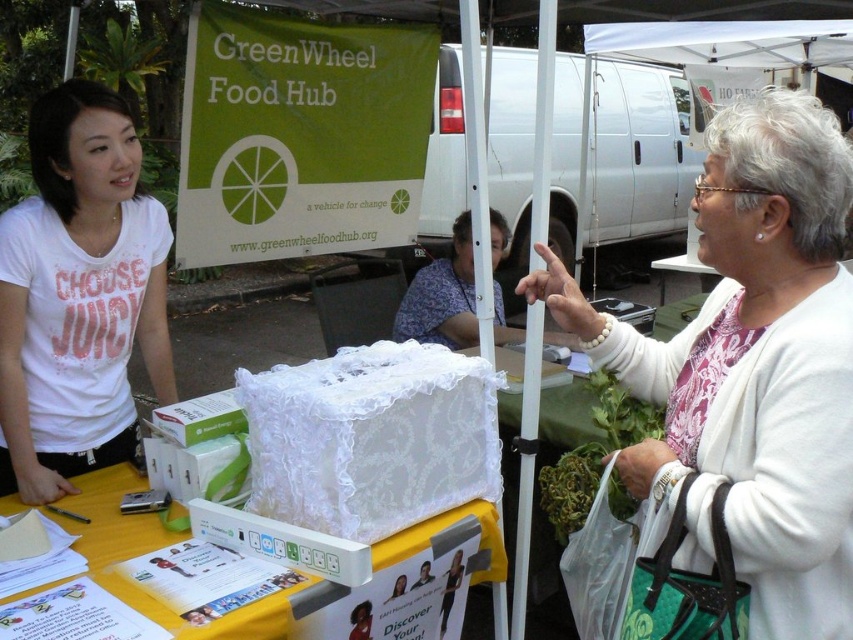
You are at the GreenWheel Food Hub event and want to pick up a promotional item. The white lace box at center contains brochures, while the floral fabric bag at center holds reusable shopping bags. If you reach forward from your current position, which item will you encounter first?

The white lace box at center is closer to the viewer than the floral fabric bag at center, so you will encounter the white lace box at center first when reaching forward.

You are organizing a small promotional event and need to place a decorative item on the table. The white lace box at center and the floral fabric bag at center are both available. Which item requires more horizontal space to accommodate?

The white lace box at center requires more horizontal space because its width surpasses that of the floral fabric bag at center.